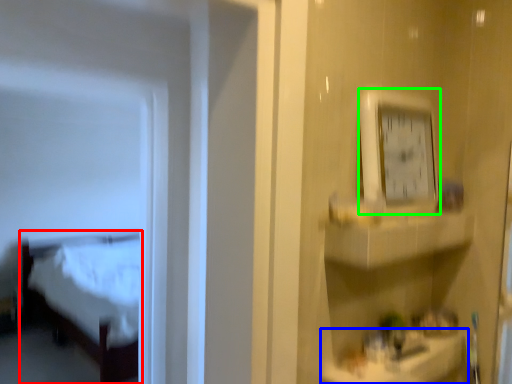
Question: Which object is the farthest from furniture (highlighted by a red box)? Choose among these: counter top (highlighted by a blue box) or clock (highlighted by a green box).

Choices:
 (A) counter top
 (B) clock

Answer: (B)